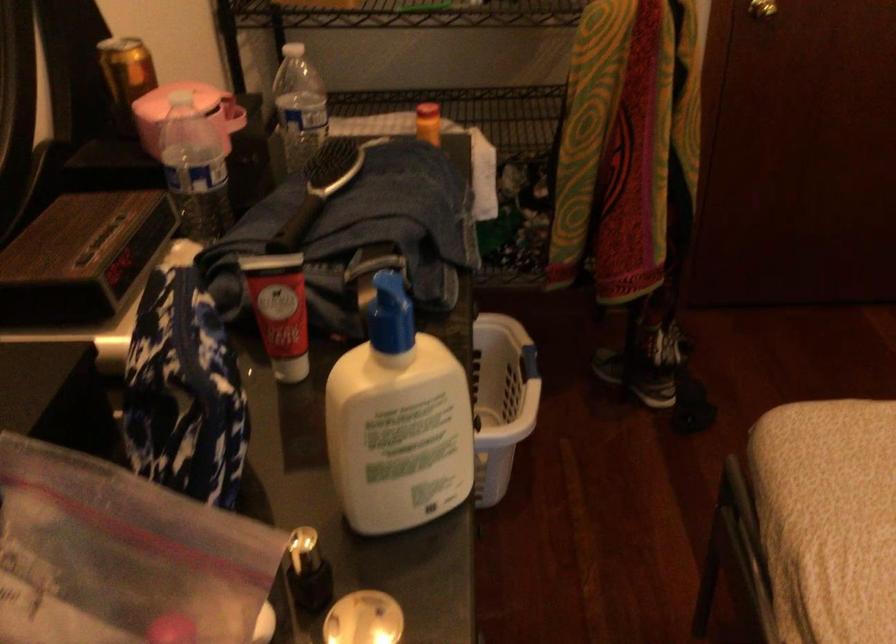
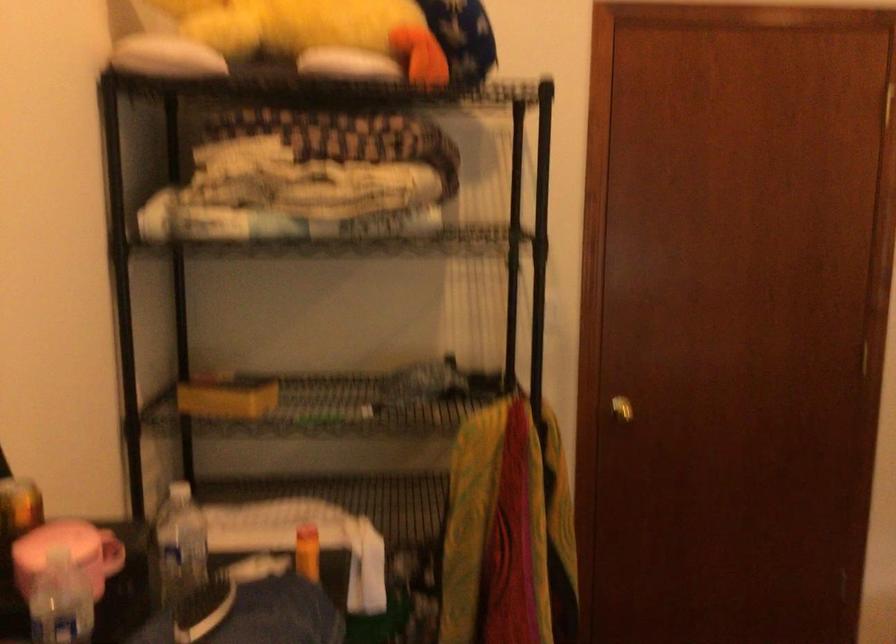
Question: The images are taken continuously from a first-person perspective. In which direction is your viewpoint rotating?

Choices:
 (A) Left
 (B) Right
 (C) Up
 (D) Down

Answer: (C)